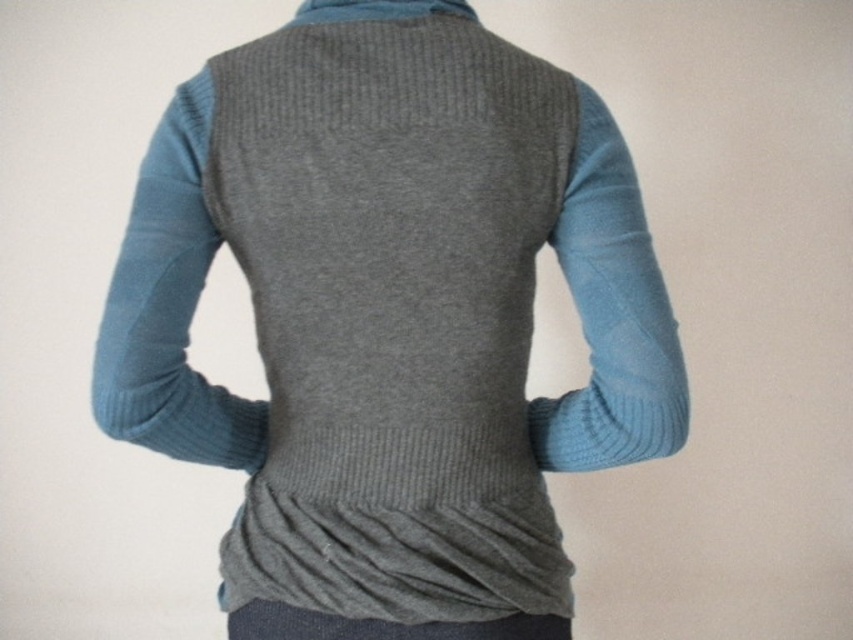
You are a photographer trying to capture a closeup of the knitted gray cardigan at center. The camera you are using has a minimum focusing distance of 30 inches. Can you take the photo without moving either the camera or the cardigan?

The knitted gray cardigan at center and camera are 28.84 inches apart from each other. Since the minimum focusing distance is 30 inches, the camera cannot focus on the cardigan at this distance. You would need to move either the camera or the cardigan further apart to achieve focus.

You are a fashion designer trying to decide whether to place a decorative button on the matte gray pocket at lower center or the light blue ribbed sweater sleeve at right. Which location would allow the button to be more visible due to the size of the area?

The light blue ribbed sweater sleeve at right has a larger size compared to the matte gray pocket at lower center, so placing the decorative button on the light blue ribbed sweater sleeve at right would make it more visible.

You are a fashion designer trying to create a matching accessory for the outfit shown. You need to decide where to place the accessory so it aligns with the existing elements. Based on the positions of the matte gray pocket at lower center and the light blue ribbed sweater sleeve at right, which object should the accessory be placed closer to and why?

The accessory should be placed closer to the light blue ribbed sweater sleeve at right because the matte gray pocket at lower center is positioned on the left side of the light blue ribbed sweater sleeve at right, making the sleeve the more prominent rightward element in the outfit.